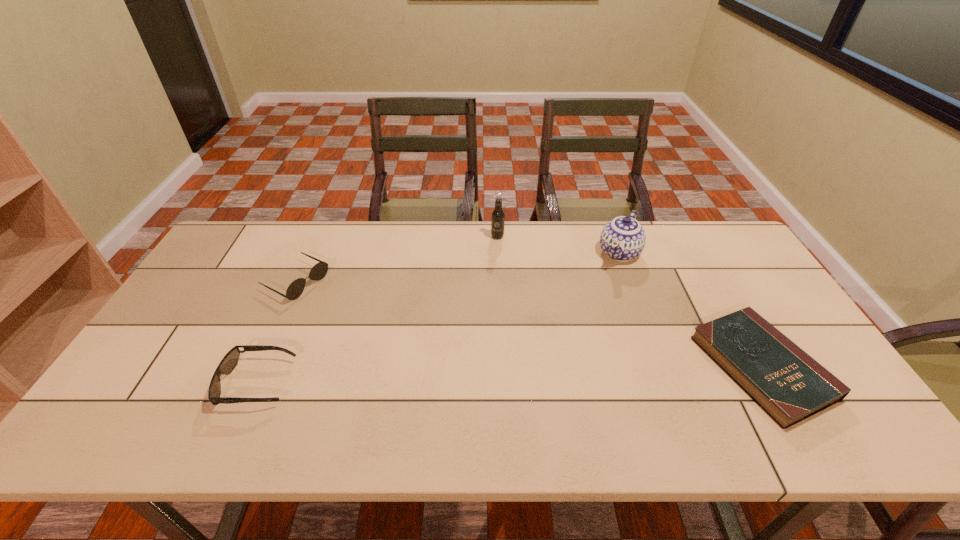
Locate an element on the screen. the nearer sunglasses is located at coordinates (230, 360).

Find the location of `the shorter sunglasses`. the shorter sunglasses is located at coordinates (230, 360).

Where is `Bible`? Bible is located at coordinates (789, 385).

Image resolution: width=960 pixels, height=540 pixels. Find the location of `the shortest object`. the shortest object is located at coordinates (789, 385).

Where is `the second object from right to left`? Image resolution: width=960 pixels, height=540 pixels. the second object from right to left is located at coordinates (623, 238).

Where is `chinaware`? chinaware is located at coordinates (623, 238).

Find the location of a particular element. This screenshot has width=960, height=540. the third object from left to right is located at coordinates (498, 216).

What are the coordinates of `root beer` in the screenshot? It's located at (498, 216).

Identify the location of the farther sunglasses. The height and width of the screenshot is (540, 960). (319, 270).

Where is `the taller sunglasses`? The height and width of the screenshot is (540, 960). the taller sunglasses is located at coordinates (319, 270).